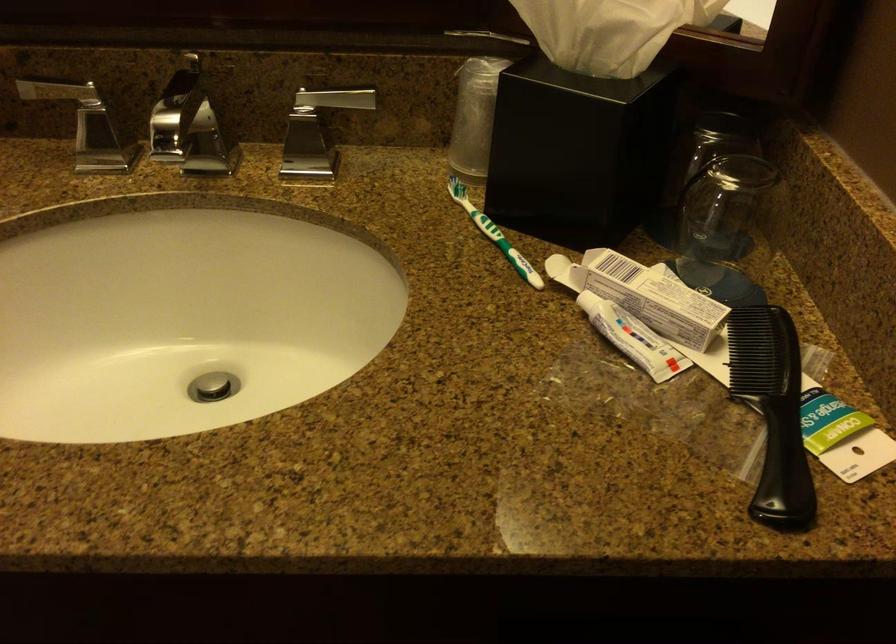
Which object does [772,411] point to?

This point indicates the black comb.